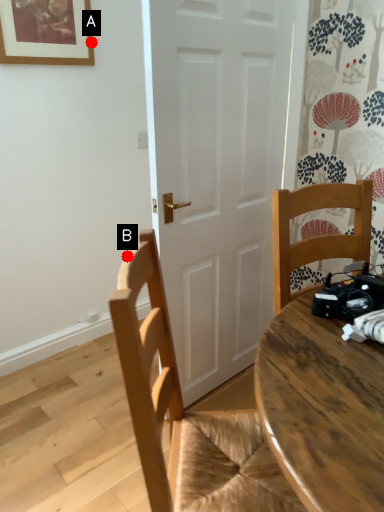
Question: Two points are circled on the image, labeled by A and B beside each circle. Which of the following is the farthest from the observer?

Choices:
 (A) A is further
 (B) B is further

Answer: (A)